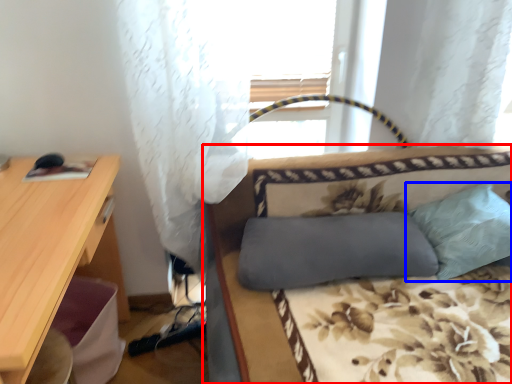
Question: Which of the following is the closest to the observer, studio couch (highlighted by a red box) or pillow (highlighted by a blue box)?

Choices:
 (A) studio couch
 (B) pillow

Answer: (A)